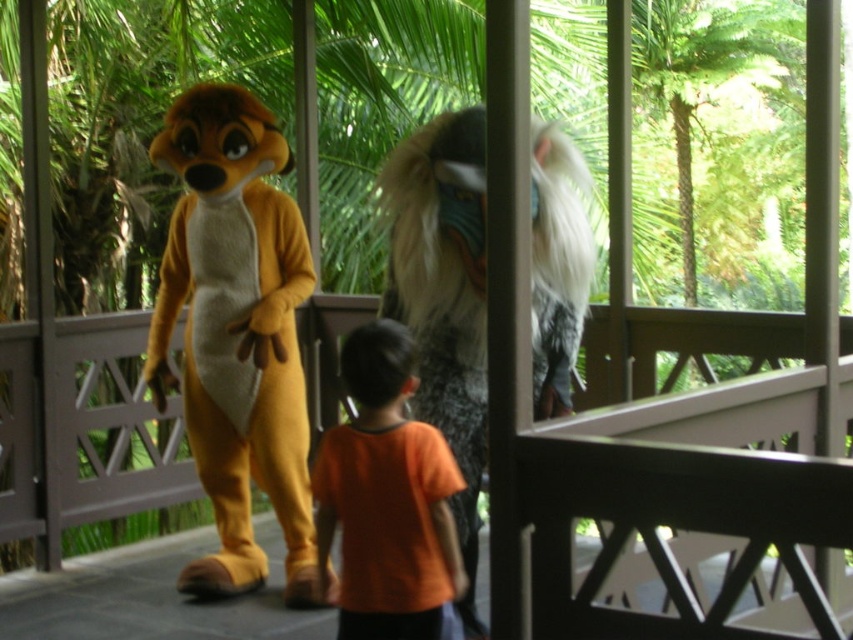
Question: Which object is farther from the camera taking this photo?

Choices:
 (A) orange cotton shirt at center
 (B) fuzzy gray fur at center
 (C) orange plush mascot at left

Answer: (C)

Question: Is orange plush mascot at left to the right of orange cotton shirt at center from the viewer's perspective?

Choices:
 (A) no
 (B) yes

Answer: (A)

Question: Which object appears closest to the camera in this image?

Choices:
 (A) orange plush mascot at left
 (B) orange cotton shirt at center

Answer: (B)

Question: Is fuzzy gray fur at center above orange cotton shirt at center?

Choices:
 (A) no
 (B) yes

Answer: (B)

Question: Among these objects, which one is farthest from the camera?

Choices:
 (A) orange cotton shirt at center
 (B) fuzzy gray fur at center
 (C) orange plush mascot at left

Answer: (C)

Question: Is orange plush mascot at left closer to camera compared to fuzzy gray fur at center?

Choices:
 (A) yes
 (B) no

Answer: (B)